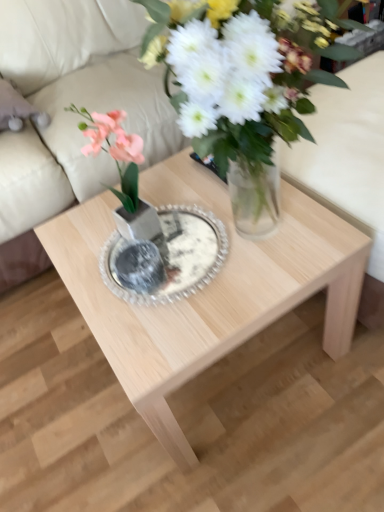
Question: Considering the relative positions of clear glass plate at center and natural wood coffee table at center in the image provided, is clear glass plate at center in front of natural wood coffee table at center?

Choices:
 (A) yes
 (B) no

Answer: (B)

Question: Is clear glass plate at center thinner than natural wood coffee table at center?

Choices:
 (A) yes
 (B) no

Answer: (A)

Question: Is clear glass plate at center bigger than natural wood coffee table at center?

Choices:
 (A) no
 (B) yes

Answer: (A)

Question: Is clear glass plate at center smaller than natural wood coffee table at center?

Choices:
 (A) no
 (B) yes

Answer: (B)

Question: Is clear glass plate at center not within natural wood coffee table at center?

Choices:
 (A) yes
 (B) no

Answer: (B)

Question: Considering the relative positions of beige fabric couch at upper center and clear glass plate at center in the image provided, is beige fabric couch at upper center to the left or to the right of clear glass plate at center?

Choices:
 (A) right
 (B) left

Answer: (B)

Question: Does point (26, 42) appear closer or farther from the camera than point (162, 208)?

Choices:
 (A) closer
 (B) farther

Answer: (B)

Question: Considering their positions, is beige fabric couch at upper center located in front of or behind clear glass plate at center?

Choices:
 (A) behind
 (B) front

Answer: (A)

Question: In terms of height, does beige fabric couch at upper center look taller or shorter compared to clear glass plate at center?

Choices:
 (A) short
 (B) tall

Answer: (B)

Question: From the image's perspective, is clear glass plate at center above or below pink silk flower at center?

Choices:
 (A) below
 (B) above

Answer: (A)

Question: Considering the positions of point (175, 206) and point (92, 128), is point (175, 206) closer or farther from the camera than point (92, 128)?

Choices:
 (A) farther
 (B) closer

Answer: (A)

Question: Based on their sizes in the image, would you say clear glass plate at center is bigger or smaller than pink silk flower at center?

Choices:
 (A) small
 (B) big

Answer: (A)

Question: Is clear glass plate at center taller or shorter than pink silk flower at center?

Choices:
 (A) short
 (B) tall

Answer: (A)

Question: Visually, is natural wood coffee table at center positioned to the left or to the right of beige fabric couch at upper center?

Choices:
 (A) left
 (B) right

Answer: (B)

Question: Relative to beige fabric couch at upper center, is natural wood coffee table at center in front or behind?

Choices:
 (A) front
 (B) behind

Answer: (A)